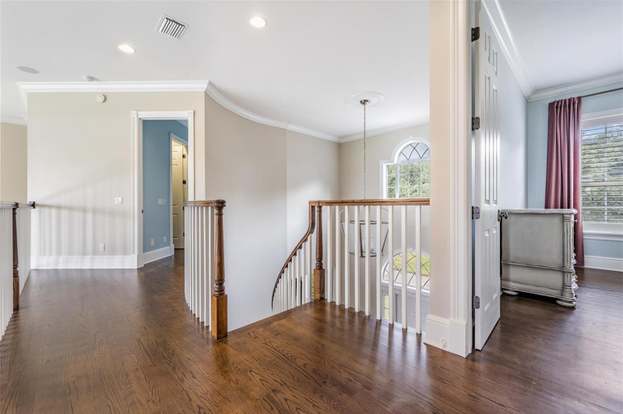
Where is `white curved wall`? white curved wall is located at coordinates (232, 163).